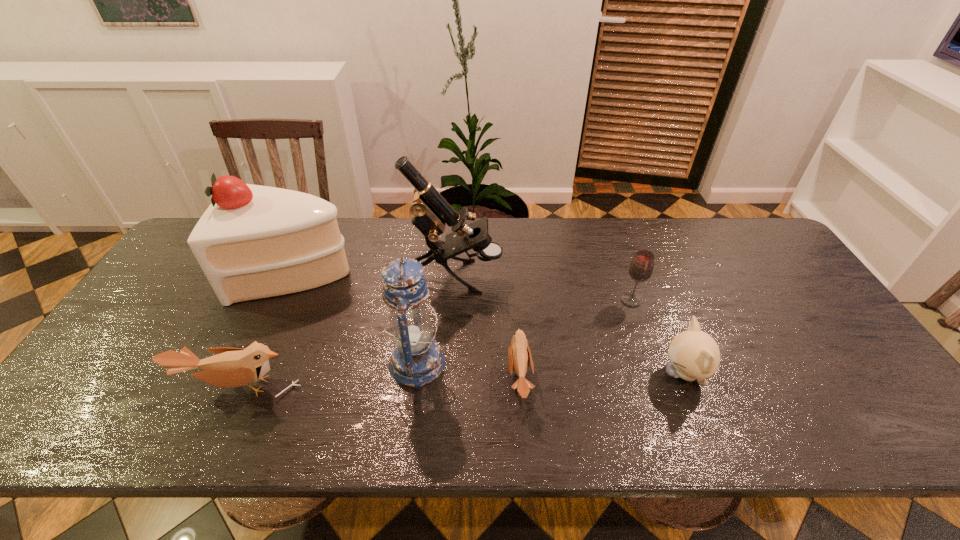
Identify the location of free location that satisfies the following two spatial constraints: 1. on the front side of the glass drink container; 2. on the front-facing side of the lantern. (653, 363).